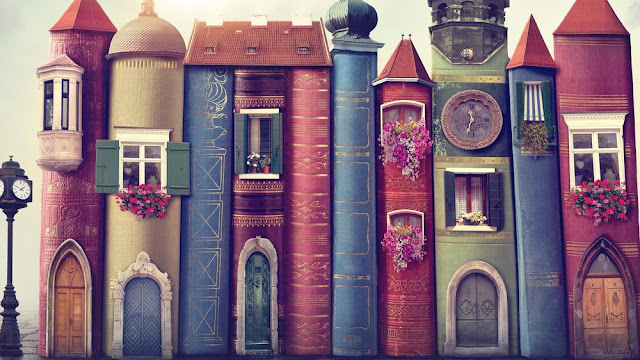
In order to click on window in this screenshot , I will do `click(152, 181)`.